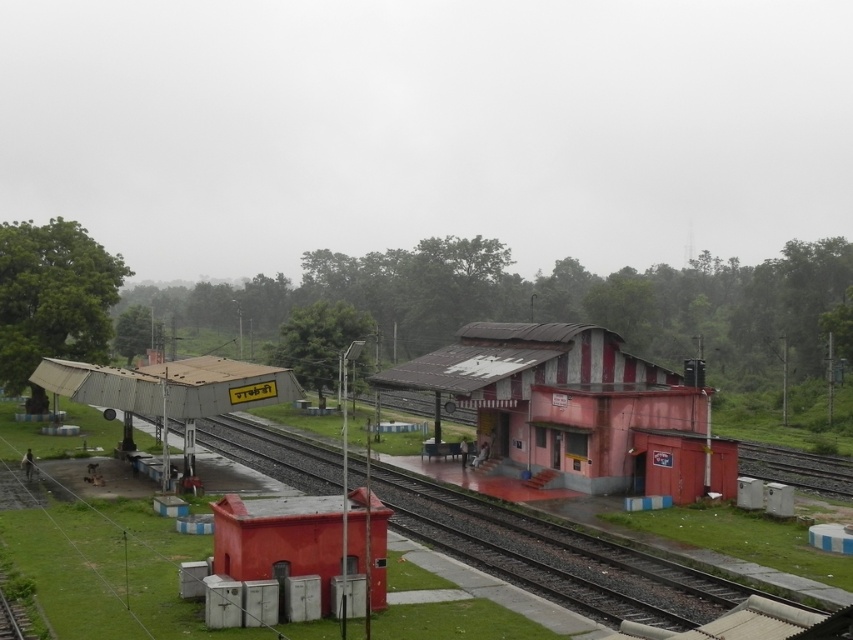
You are a passenger waiting at the station and want to walk from the smooth red utility box at lower left to the smooth concrete train track at center. Which direction should you move to reach the track?

To reach the smooth concrete train track at center from the smooth red utility box at lower left, you should move downward since the track is positioned below the utility box.

You are standing at the coordinates point 0.5, 0.5 in the image. You want to walk to the rusty metal railway station at center. In which direction should you move?

The rusty metal railway station at center is located at point [577,410]. Since your current position is at [426,320], you should move northeast to reach it.

From the picture: You are a maintenance worker needing to repair both the rusty metal railway station at center and the smooth concrete train track at center. Which structure requires more materials if the amount of material needed is proportional to the size of the object?

The smooth concrete train track at center requires more materials because it is larger than the rusty metal railway station at center.